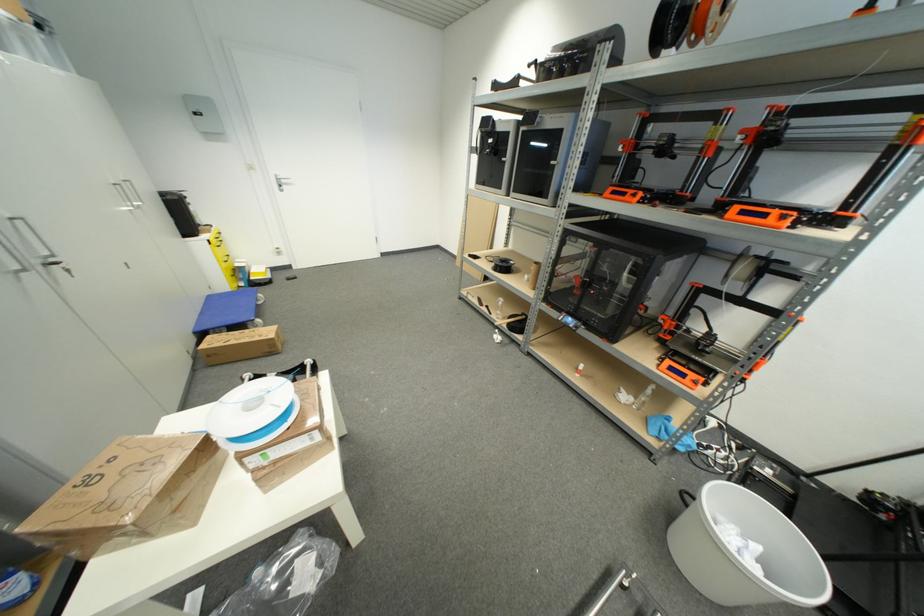
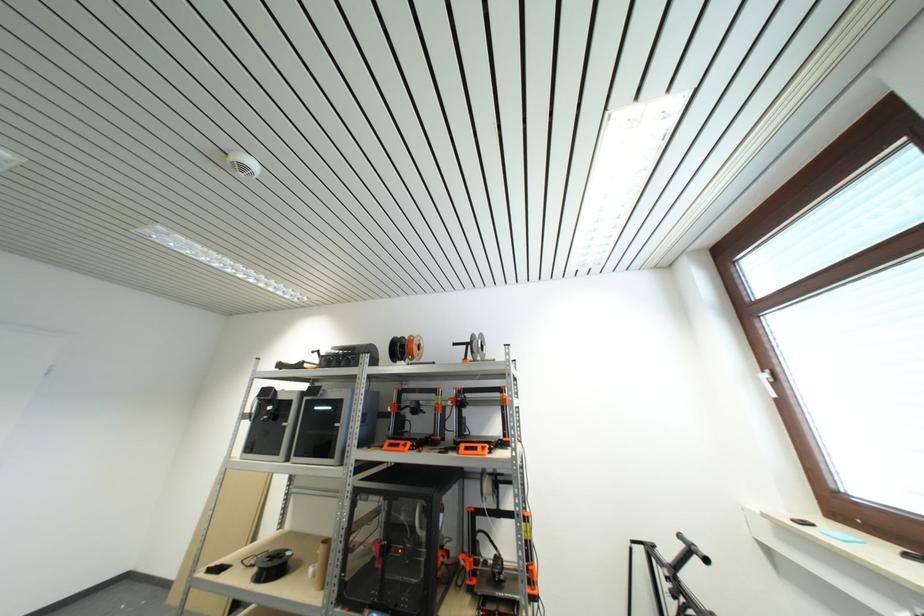
In the second image, find the point that corresponds to point (505, 191) in the first image.

(283, 456)